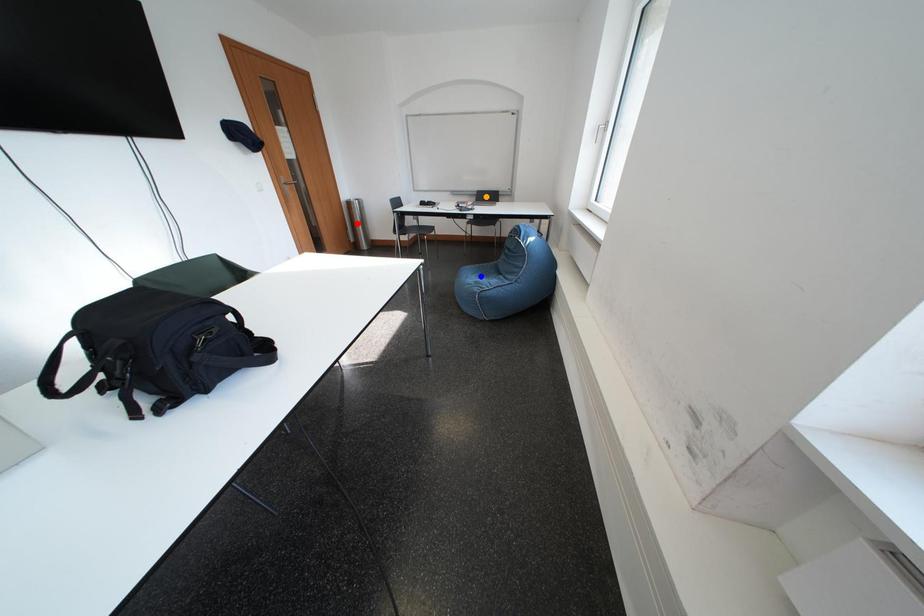
In the scene shown: Order these from farthest to nearest:
- red point
- orange point
- blue point

red point < orange point < blue point